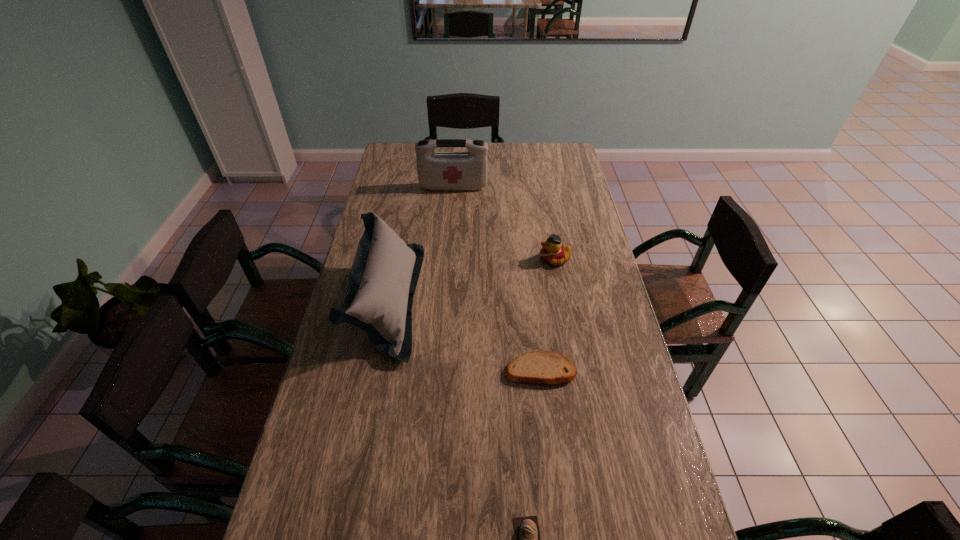
Where is `object positioned at the left edge`? This screenshot has width=960, height=540. object positioned at the left edge is located at coordinates (382, 281).

You are a GUI agent. You are given a task and a screenshot of the screen. Output one action in this format:
    pyautogui.click(x=<x>, y=<y>)
    Task: Click on the object located in the right edge section of the desktop
    Image resolution: width=960 pixels, height=540 pixels.
    Given the screenshot: What is the action you would take?
    pyautogui.click(x=553, y=252)

At what (x,y) coordinates should I click in order to perform the action: click on blank space at the left edge of the desktop. Please return your answer as a coordinate pair (x, y). Looking at the image, I should click on (302, 468).

In the image, there is a desktop. What are the coordinates of `free space at the right edge` in the screenshot? It's located at (568, 304).

Where is `blank space at the far left corner`? blank space at the far left corner is located at coordinates coord(387,162).

At what (x,y) coordinates should I click in order to perform the action: click on free space at the far right corner. Please return your answer as a coordinate pair (x, y). Looking at the image, I should click on (551, 168).

Identify the location of vacant region between the farther pita bread and the farthest object. The width and height of the screenshot is (960, 540). (496, 278).

You are a GUI agent. You are given a task and a screenshot of the screen. Output one action in this format:
    pyautogui.click(x=<x>, y=<y>)
    Task: Click on the free area in between the cushion and the first-aid kit
    The image size is (960, 540).
    Given the screenshot: What is the action you would take?
    (420, 244)

Locate an element on the screen. unoccupied position between the third shortest object and the farther pita bread is located at coordinates (547, 314).

You are a GUI agent. You are given a task and a screenshot of the screen. Output one action in this format:
    pyautogui.click(x=<x>, y=<y>)
    Task: Click on the free point between the third tallest object and the farthest object
    Image resolution: width=960 pixels, height=540 pixels.
    Given the screenshot: What is the action you would take?
    pyautogui.click(x=504, y=223)